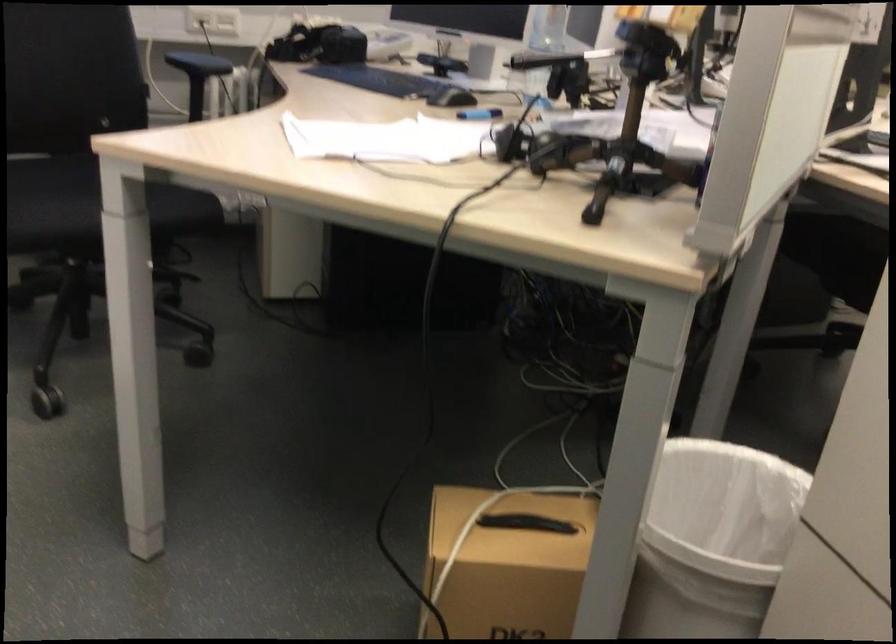
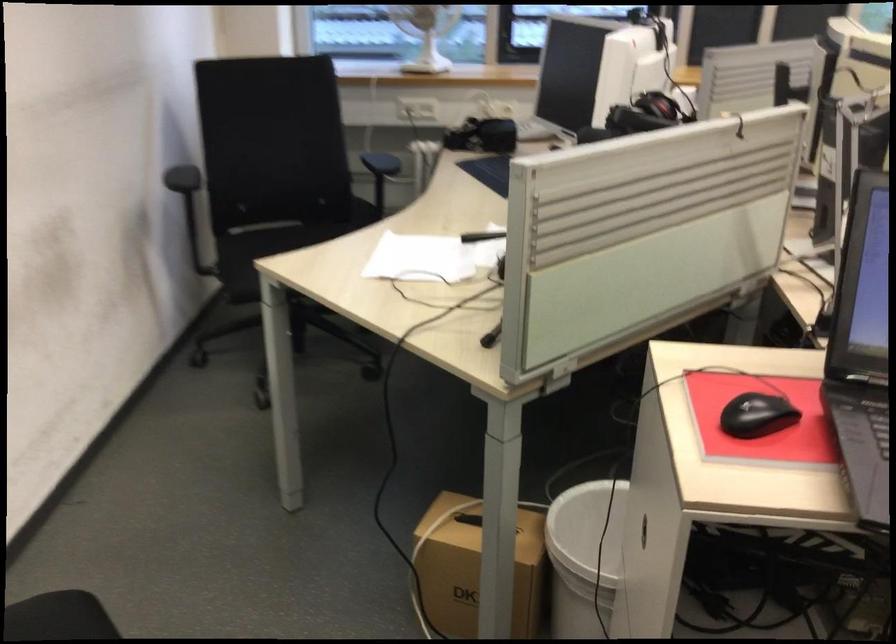
Where in the second image is the point corresponding to the point at 642,545 from the first image?

(584, 556)